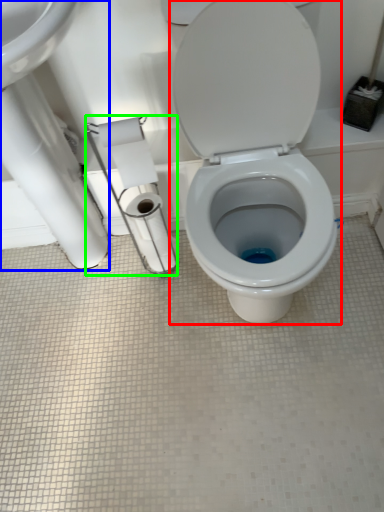
Question: Considering the real-world distances, which object is farthest from toilet (highlighted by a red box)? sink (highlighted by a blue box) or toilet paper (highlighted by a green box)?

Choices:
 (A) sink
 (B) toilet paper

Answer: (A)